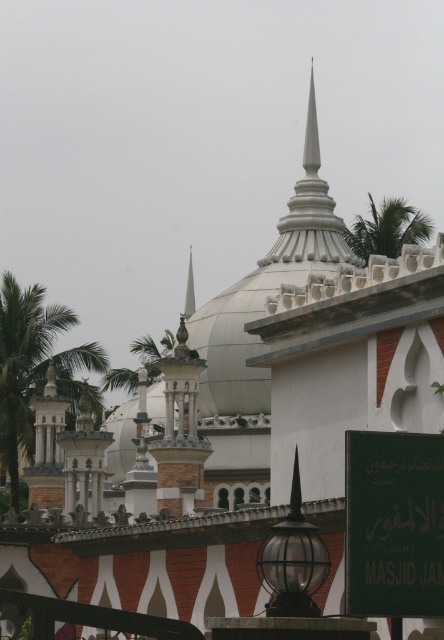
You are standing in front of the mosque and want to take a photo that includes both the green leafy palm tree at left and the camera. How far apart are these two objects?

The distance between the green leafy palm tree at left and the camera is 121.26 meters.

Based on the photo, you are an architect designing a new mosque and want to incorporate elements from this mosque. You notice the black glass globe at center and the green leafy palm tree at upper right. Which of these two elements is narrower in width?

The black glass globe at center is narrower in width than the green leafy palm tree at upper right.

You are standing in front of the mosque and want to take a photo that includes both the white glossy spire at center and the black glass globe at center. Which object should you position closer to the front of your camera frame to ensure both are in focus?

You should position the white glossy spire at center closer to the front of your camera frame because it is closer to you than the black glass globe at center, ensuring both are in focus.